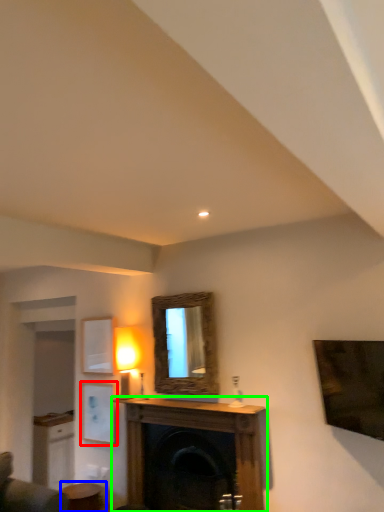
Question: Which object is positioned farthest from picture frame (highlighted by a red box)? Select from table (highlighted by a blue box) and fireplace (highlighted by a green box).

Choices:
 (A) table
 (B) fireplace

Answer: (B)